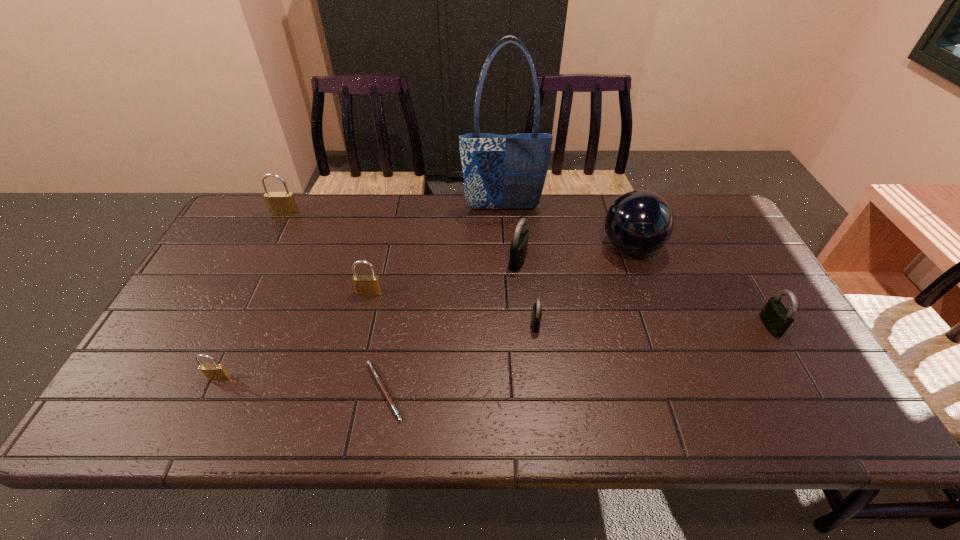
Find the location of a particular element. vacant space that's between the nearest padlock and the farthest padlock is located at coordinates (252, 295).

Find the location of a particular element. The width and height of the screenshot is (960, 540). free space between the biggest black padlock and the smallest black padlock is located at coordinates (527, 292).

Find the location of a particular element. vacant space that's between the second smallest black padlock and the pink pen is located at coordinates (577, 359).

Find the location of `vacant point located between the biggest black padlock and the smallest black padlock`. vacant point located between the biggest black padlock and the smallest black padlock is located at coordinates (527, 292).

This screenshot has height=540, width=960. Find the location of `free spot between the black bowling ball and the nearest brass padlock`. free spot between the black bowling ball and the nearest brass padlock is located at coordinates (424, 312).

Locate an element on the screen. vacant area that lies between the biggest brass padlock and the shopping bag is located at coordinates (394, 211).

I want to click on vacant area that lies between the smallest black padlock and the fifth nearest padlock, so click(527, 292).

At what (x,y) coordinates should I click in order to perform the action: click on free space that is in between the second object from right to left and the smallest brass padlock. Please return your answer as a coordinate pair (x, y). This screenshot has width=960, height=540. Looking at the image, I should click on (424, 312).

Locate which object is the fifth closest to the black bowling ball. Please provide its 2D coordinates. Your answer should be formatted as a tuple, i.e. [(x, y)], where the tuple contains the x and y coordinates of a point satisfying the conditions above.

[(372, 368)]

Identify which object is located as the fourth nearest to the rightmost padlock. Please provide its 2D coordinates. Your answer should be formatted as a tuple, i.e. [(x, y)], where the tuple contains the x and y coordinates of a point satisfying the conditions above.

[(500, 171)]